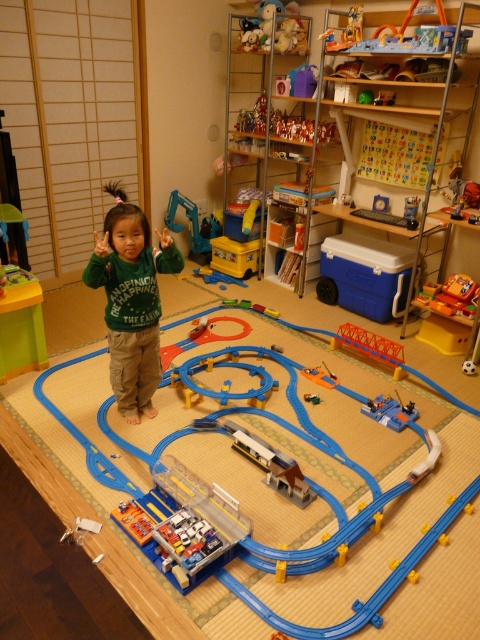
The child is wearing a green long sleeved shirt with white text and beige pants. They are standing in a room with a toy train set. You need to place a new toy car on the floor near the orange plastic train at center. However, there is a green fleece sweater at center covering part of the train. Can you tell me where exactly you should place the new toy car so it doesn not get covered by the sweater?

The green fleece sweater at center is positioned over orange plastic train at center. To avoid covering the new toy car, place it near the orange plastic train at center but outside the area covered by the green fleece sweater at center.

You are a parent trying to pick up toys in the room. You see the green fleece sweater at center and the orange plastic train at center. If you want to put both items into a storage box that can only hold items within 4 feet of each other, will they fit together in the box?

The distance between the green fleece sweater at center and the orange plastic train at center is 4.22 feet, which exceeds the 4 feet limit. Therefore, they cannot fit together in the storage box.

You are a parent trying to organize the child and their toys. You need to place a new toy car between the blue plastic train at center and the blue plastic train at lower right. Which train should the new toy car be closer to to ensure it fits properly?

The blue plastic train at center is larger in size than the blue plastic train at lower right. To ensure the new toy car fits properly, it should be placed closer to the smaller blue plastic train at lower right since there is more space between them compared to the larger train at center.